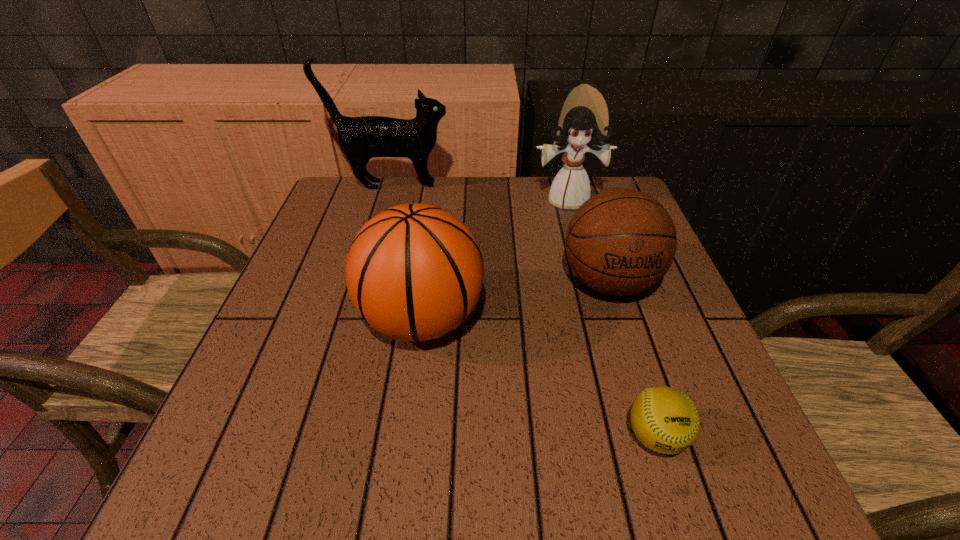
The height and width of the screenshot is (540, 960). What are the coordinates of `free space located 0.210m on the side with brand label of the shorter basketball` in the screenshot? It's located at coord(652,415).

Locate an element on the screen. The width and height of the screenshot is (960, 540). cat positioned at the far edge is located at coordinates (361, 138).

Find the location of a particular element. doll that is at the far edge is located at coordinates (584, 119).

Where is `object located at the near edge`? object located at the near edge is located at coordinates (665, 420).

Where is `object that is at the left edge`? The height and width of the screenshot is (540, 960). object that is at the left edge is located at coordinates (361, 138).

Locate an element on the screen. The height and width of the screenshot is (540, 960). doll at the right edge is located at coordinates (584, 119).

The image size is (960, 540). Identify the location of basketball positioned at the right edge. (619, 242).

At what (x,y) coordinates should I click in order to perform the action: click on softball positioned at the right edge. Please return your answer as a coordinate pair (x, y). Looking at the image, I should click on (665, 420).

The width and height of the screenshot is (960, 540). I want to click on object at the far left corner, so click(x=361, y=138).

At what (x,y) coordinates should I click in order to perform the action: click on object situated at the far right corner. Please return your answer as a coordinate pair (x, y). The image size is (960, 540). Looking at the image, I should click on (584, 119).